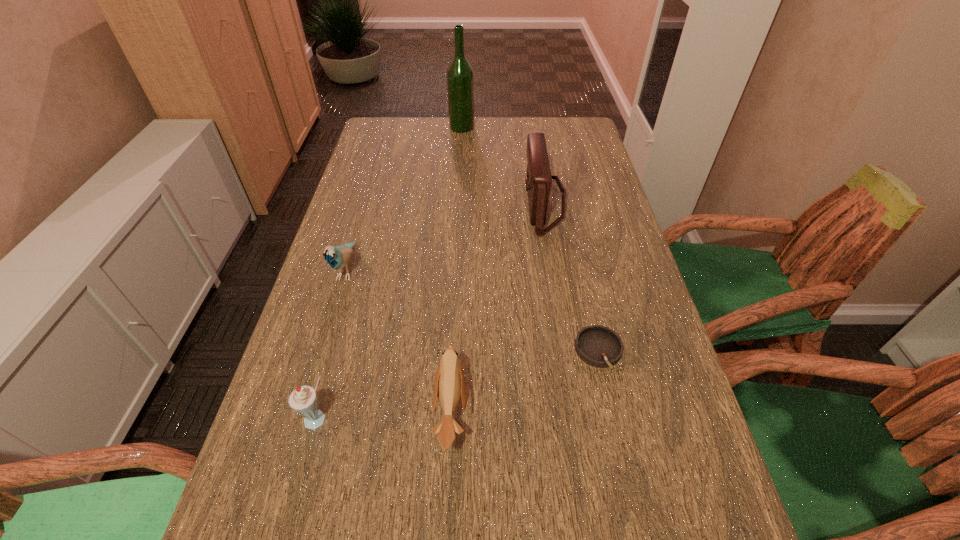
You are a GUI agent. You are given a task and a screenshot of the screen. Output one action in this format:
    pyautogui.click(x=<x>, y=<y>)
    Task: Click on the vacant space that satisfies the following two spatial constraints: 1. on the back side of the shortest object; 2. on the front flap of the second tallest object
    The height and width of the screenshot is (540, 960).
    Given the screenshot: What is the action you would take?
    pyautogui.click(x=565, y=202)

The width and height of the screenshot is (960, 540). Find the location of `vacant space that satisfies the following two spatial constraints: 1. on the back side of the shortest object; 2. on the front flap of the second farthest object`. vacant space that satisfies the following two spatial constraints: 1. on the back side of the shortest object; 2. on the front flap of the second farthest object is located at coordinates (565, 202).

Locate an element on the screen. The height and width of the screenshot is (540, 960). blank area in the image that satisfies the following two spatial constraints: 1. at the face of the farther bird; 2. on the left side of the shortest object is located at coordinates (322, 351).